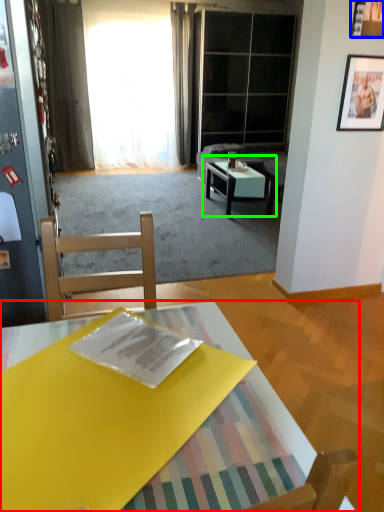
Question: Which is nearer to the coffee table (highlighted by a red box)? picture frame (highlighted by a blue box) or coffee table (highlighted by a green box).

Choices:
 (A) picture frame
 (B) coffee table

Answer: (A)